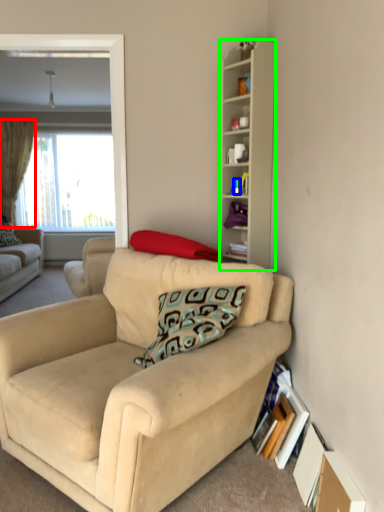
Question: Which object is the farthest from curtain (highlighted by a red box)? Choose among these: teal (highlighted by a blue box) or cabinetry (highlighted by a green box).

Choices:
 (A) teal
 (B) cabinetry

Answer: (A)